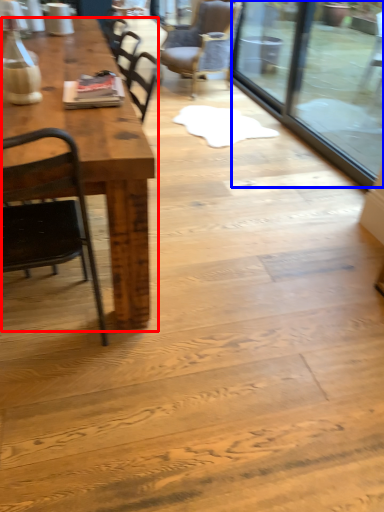
Question: Which object is further to the camera taking this photo, table (highlighted by a red box) or glass door (highlighted by a blue box)?

Choices:
 (A) table
 (B) glass door

Answer: (B)